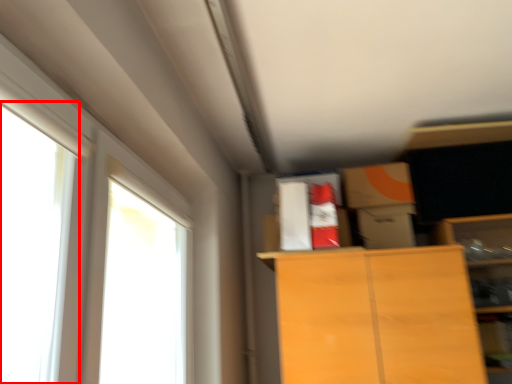
Question: In this image, where is window (annotated by the red box) located relative to window?

Choices:
 (A) right
 (B) left

Answer: (B)